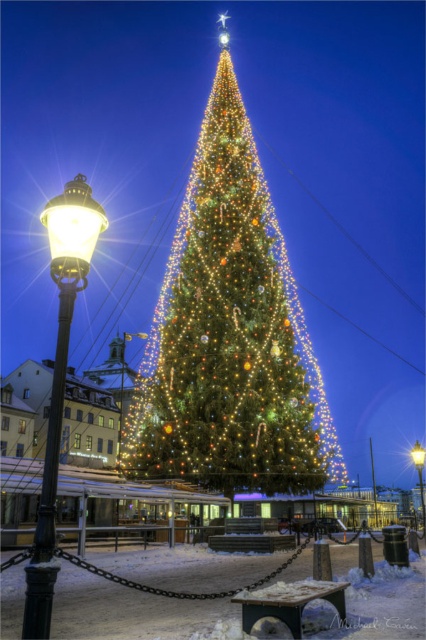
Question: Estimate the real-world distances between objects in this image. Which object is closer to the matte black lamp post at lower left?

Choices:
 (A) green matte christmas tree at center
 (B) black polished metal streetlamp at left

Answer: (A)

Question: Observing the image, what is the correct spatial positioning of green matte christmas tree at center in reference to black polished metal streetlamp at left?

Choices:
 (A) above
 (B) below

Answer: (A)

Question: Can you confirm if metallic streetlamp at center is bigger than matte black lamp post at lower left?

Choices:
 (A) no
 (B) yes

Answer: (B)

Question: Among these objects, which one is farthest from the camera?

Choices:
 (A) black polished metal streetlamp at left
 (B) green matte christmas tree at center
 (C) matte black lamp post at lower left

Answer: (C)

Question: Among these objects, which one is nearest to the camera?

Choices:
 (A) black polished metal streetlamp at left
 (B) metallic streetlamp at center
 (C) matte brass streetlamp at left

Answer: (A)

Question: Can you confirm if matte brass streetlamp at left is positioned to the right of black polished metal streetlamp at left?

Choices:
 (A) no
 (B) yes

Answer: (A)